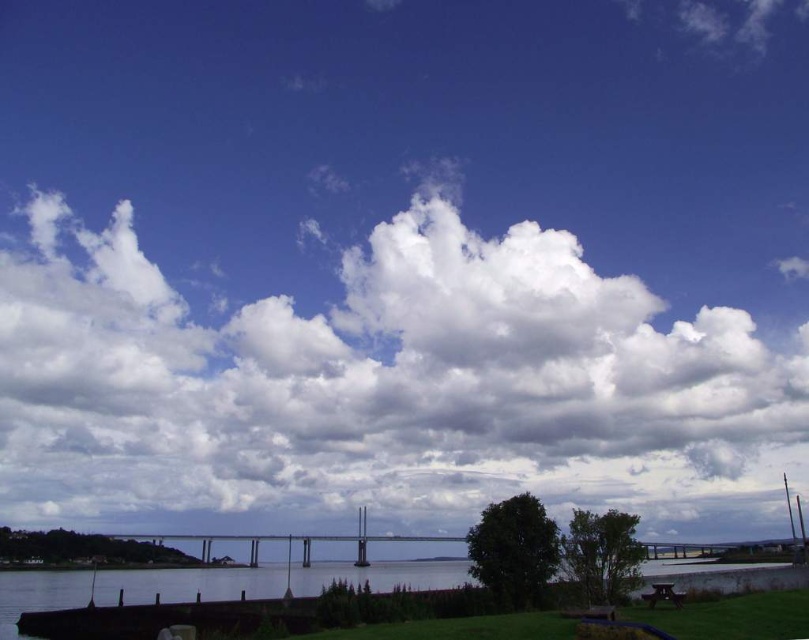
Question: Where is clear water at lower center located in relation to wooden park bench at lower right in the image?

Choices:
 (A) above
 (B) below

Answer: (B)

Question: Among these points, which one is farthest from the camera?

Choices:
 (A) (672, 602)
 (B) (289, 317)

Answer: (B)

Question: Is clear water at lower center above wooden park bench at lower right?

Choices:
 (A) yes
 (B) no

Answer: (B)

Question: Which point appears farthest from the camera in this image?

Choices:
 (A) (647, 600)
 (B) (37, 225)

Answer: (B)

Question: Does white fluffy cloud at upper center appear over wooden park bench at lower right?

Choices:
 (A) yes
 (B) no

Answer: (A)

Question: Which of the following is the farthest from the observer?

Choices:
 (A) white fluffy cloud at upper center
 (B) wooden park bench at lower right

Answer: (A)